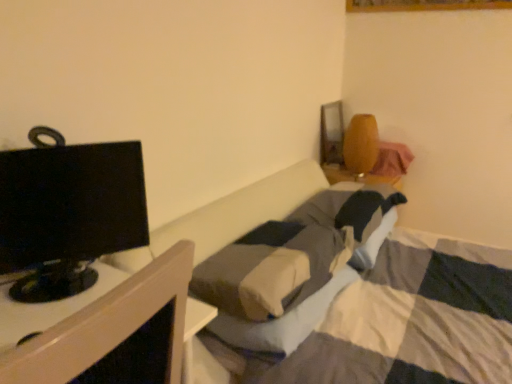
What is the approximate height of black glossy monitor at left?

It is 12.76 inches.

Measure the distance between black glossy monitor at left and camera.

The distance of black glossy monitor at left from camera is 15.50 inches.

The height and width of the screenshot is (384, 512). What are the coordinates of `black glossy monitor at left` in the screenshot? It's located at (114, 333).

The height and width of the screenshot is (384, 512). What do you see at coordinates (114, 333) in the screenshot? I see `black glossy monitor at left` at bounding box center [114, 333].

The image size is (512, 384). Find the location of `black glossy monitor at left`. black glossy monitor at left is located at coordinates (68, 214).

The image size is (512, 384). What do you see at coordinates (68, 214) in the screenshot?
I see `black glossy monitor at left` at bounding box center [68, 214].

Find the location of a particular element. The image size is (512, 384). black glossy monitor at left is located at coordinates (114, 333).

Is black glossy monitor at left at the left side of black glossy monitor at left?

Incorrect, black glossy monitor at left is not on the left side of black glossy monitor at left.

Is black glossy monitor at left positioned behind black glossy monitor at left?

No, black glossy monitor at left is closer to the viewer.

Considering the positions of point (158, 270) and point (133, 233), is point (158, 270) closer or farther from the camera than point (133, 233)?

Point (158, 270).

From the image's perspective, is black glossy monitor at left located above or below black glossy monitor at left?

black glossy monitor at left is below black glossy monitor at left.

Based on the photo, from a real-world perspective, which is physically above, black glossy monitor at left or black glossy monitor at left?

black glossy monitor at left.

Considering the relative sizes of black glossy monitor at left and black glossy monitor at left in the image provided, is black glossy monitor at left thinner than black glossy monitor at left?

In fact, black glossy monitor at left might be wider than black glossy monitor at left.

Which of these two, black glossy monitor at left or black glossy monitor at left, stands shorter?

With less height is black glossy monitor at left.

Considering the sizes of black glossy monitor at left and black glossy monitor at left in the image, is black glossy monitor at left bigger or smaller than black glossy monitor at left?

Clearly, black glossy monitor at left is larger in size than black glossy monitor at left.

Is black glossy monitor at left situated inside black glossy monitor at left or outside?

black glossy monitor at left lies outside black glossy monitor at left.

Is black glossy monitor at left touching black glossy monitor at left?

black glossy monitor at left and black glossy monitor at left are clearly separated.

From the picture: Could you tell me if black glossy monitor at left is facing black glossy monitor at left?

No, black glossy monitor at left is not facing towards black glossy monitor at left.

Measure the distance between black glossy monitor at left and black glossy monitor at left.

They are 21.64 inches apart.

Locate an element on the screen. The width and height of the screenshot is (512, 384). furniture that appears on the right of black glossy monitor at left is located at coordinates (114, 333).

Can you confirm if black glossy monitor at left is positioned to the right of black glossy monitor at left?

In fact, black glossy monitor at left is to the left of black glossy monitor at left.

Relative to black glossy monitor at left, is black glossy monitor at left in front or behind?

Visually, black glossy monitor at left is located behind black glossy monitor at left.

Considering the positions of point (67, 154) and point (133, 284), is point (67, 154) closer or farther from the camera than point (133, 284)?

Point (67, 154) appears to be farther away from the viewer than point (133, 284).

From the image's perspective, which is above, black glossy monitor at left or black glossy monitor at left?

From the image's view, black glossy monitor at left is above.

From a real-world perspective, is black glossy monitor at left below black glossy monitor at left?

Actually, black glossy monitor at left is physically above black glossy monitor at left in the real world.

Can you confirm if black glossy monitor at left is wider than black glossy monitor at left?

No.

Considering the relative sizes of black glossy monitor at left and black glossy monitor at left in the image provided, is black glossy monitor at left shorter than black glossy monitor at left?

No, black glossy monitor at left is not shorter than black glossy monitor at left.

Is black glossy monitor at left smaller than black glossy monitor at left?

Yes, black glossy monitor at left is smaller than black glossy monitor at left.

Is black glossy monitor at left completely or partially outside of black glossy monitor at left?

Yes, black glossy monitor at left is located beyond the bounds of black glossy monitor at left.

Is black glossy monitor at left directly adjacent to black glossy monitor at left?

No.

Is black glossy monitor at left positioned with its back to black glossy monitor at left?

No, black glossy monitor at left is not at the back of black glossy monitor at left.

How much distance is there between black glossy monitor at left and black glossy monitor at left?

black glossy monitor at left and black glossy monitor at left are 21.64 inches apart from each other.

This screenshot has height=384, width=512. There is a black glossy monitor at left. In order to click on television above it (from a real-world perspective) in this screenshot , I will do `click(68, 214)`.

The height and width of the screenshot is (384, 512). Identify the location of furniture below the black glossy monitor at left (from the image's perspective). (114, 333).

This screenshot has height=384, width=512. I want to click on television lying on the left of black glossy monitor at left, so 68,214.